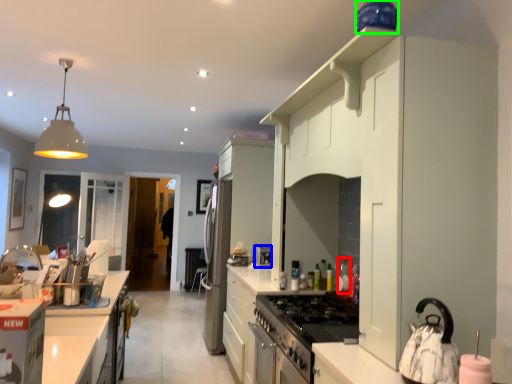
Question: Which object is positioned farthest from bottle (highlighted by a red box)? Select from appliance (highlighted by a blue box) and appliance (highlighted by a green box).

Choices:
 (A) appliance
 (B) appliance

Answer: (B)